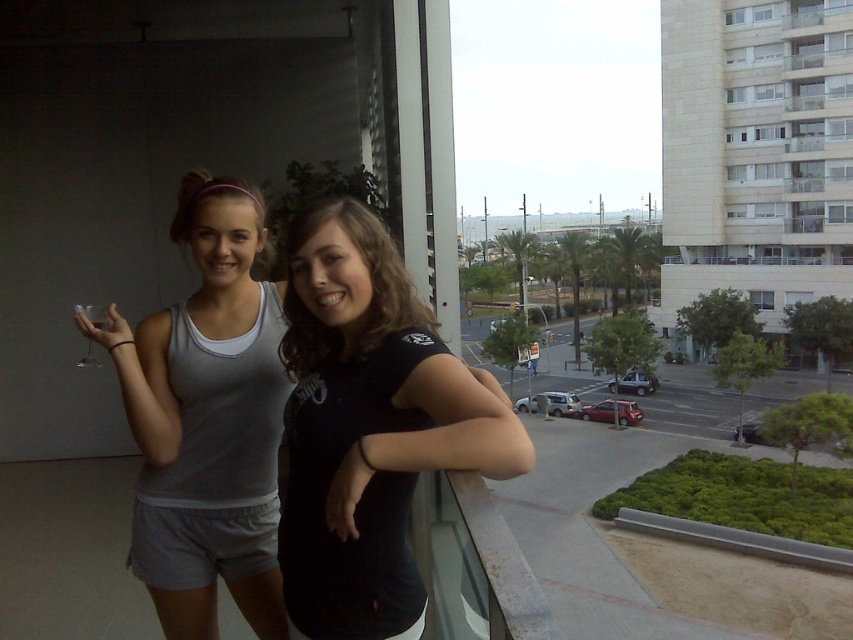
Question: Observing the image, what is the correct spatial positioning of black matte t-shirt at center in reference to gray fabric tank top at left?

Choices:
 (A) above
 (B) below

Answer: (A)

Question: Is black matte t-shirt at center smaller than gray fabric tank top at left?

Choices:
 (A) yes
 (B) no

Answer: (B)

Question: Which point is closer to the camera?

Choices:
 (A) gray fabric tank top at left
 (B) black matte t-shirt at center

Answer: (B)

Question: Which of the following is the closest to the observer?

Choices:
 (A) gray fabric tank top at left
 (B) black matte t-shirt at center

Answer: (B)

Question: Observing the image, what is the correct spatial positioning of black matte t-shirt at center in reference to gray fabric tank top at left?

Choices:
 (A) below
 (B) above

Answer: (B)

Question: Which of the following is the farthest from the observer?

Choices:
 (A) black matte t-shirt at center
 (B) gray fabric tank top at left

Answer: (B)